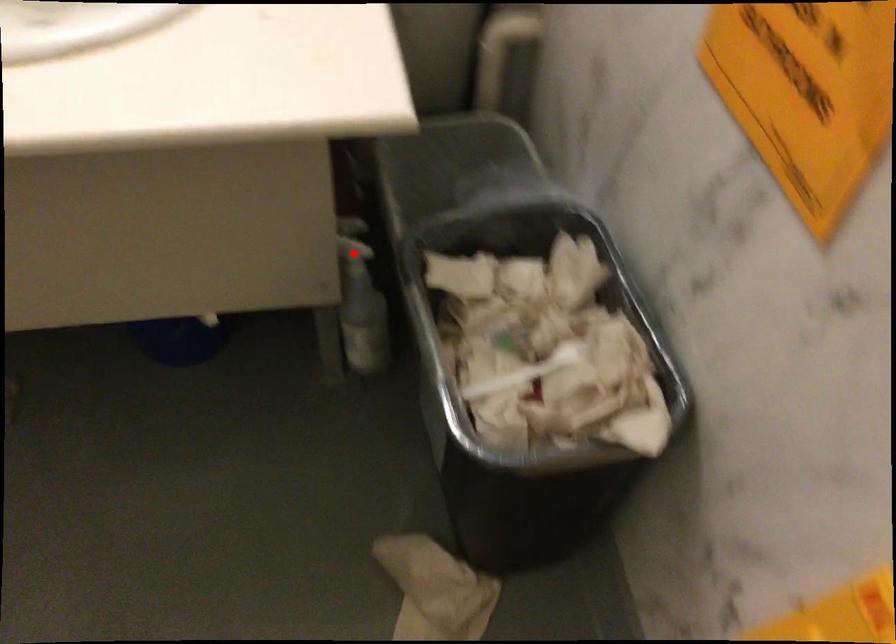
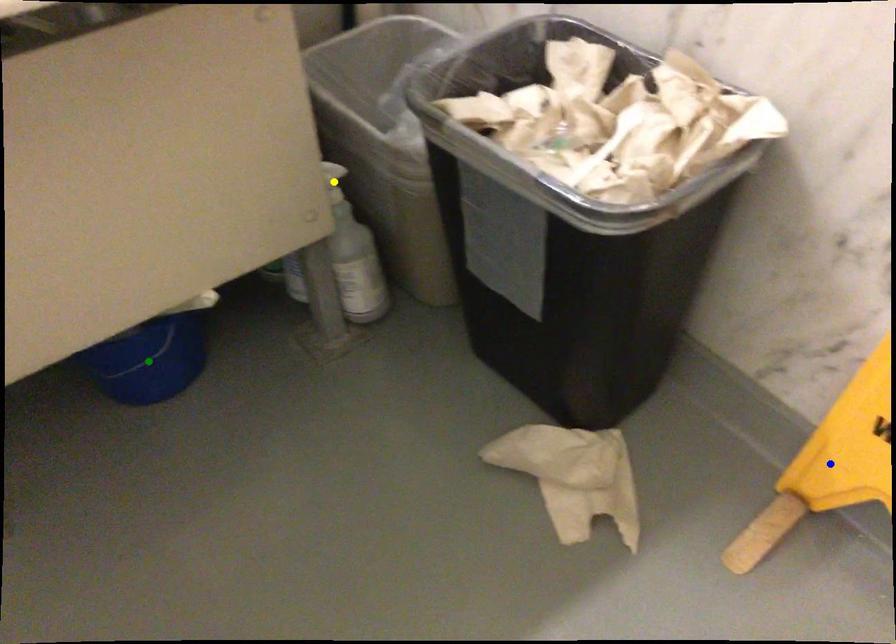
Question: I am providing you with two images of the same scene from different viewpoints. A red point is marked on the first image. You are given multiple points on the second image. Which spot in image 2 lines up with the point in image 1?

Choices:
 (A) yellow point
 (B) blue point
 (C) green point

Answer: (A)